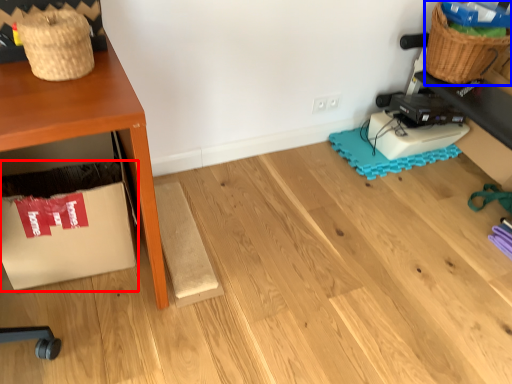
Question: Which object is closer to the camera taking this photo, cardboard box (highlighted by a red box) or basket (highlighted by a blue box)?

Choices:
 (A) cardboard box
 (B) basket

Answer: (A)